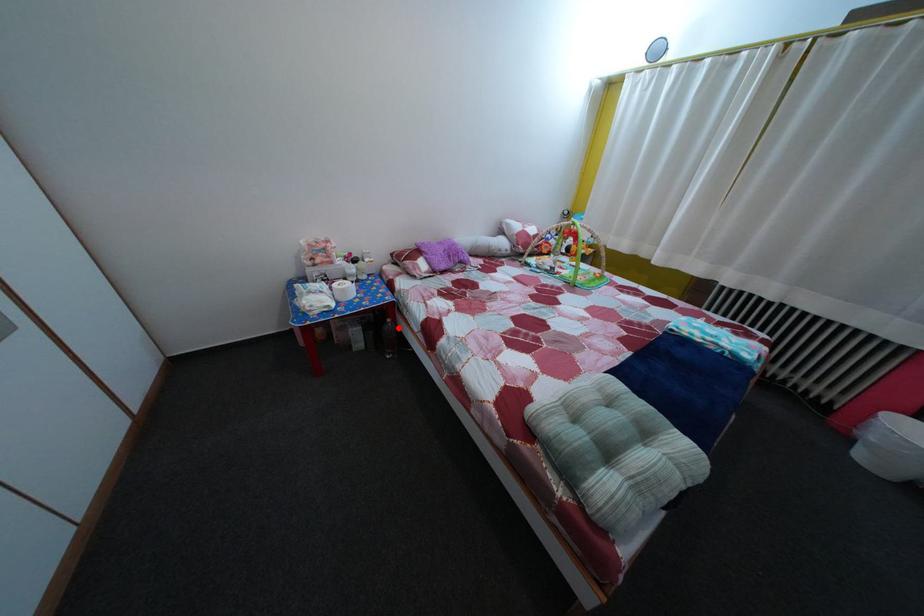
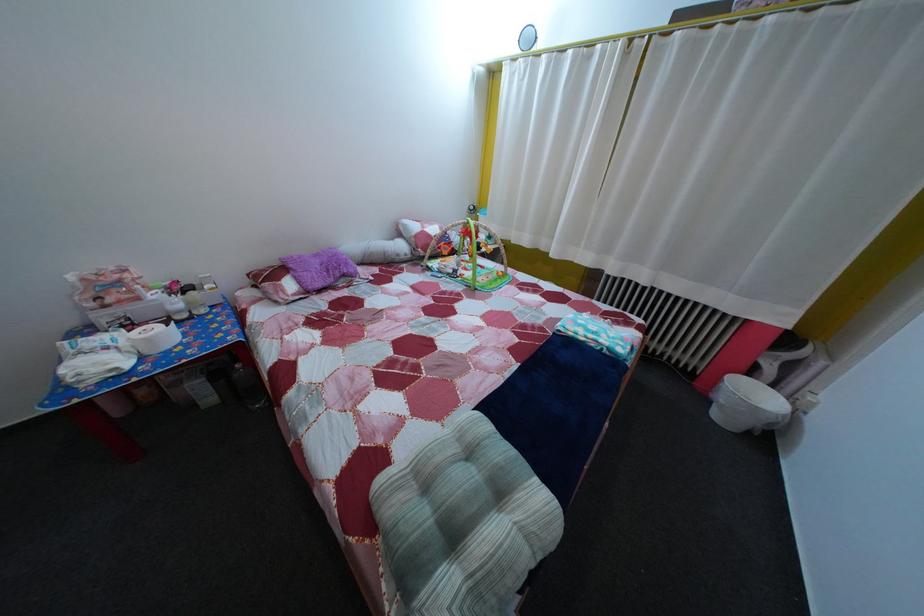
Question: I am providing you with two images of the same scene from different viewpoints. A red point is marked on the first image. At the location where the point appears in image 1, is it still visible in image 2?

Choices:
 (A) Yes
 (B) No

Answer: (A)